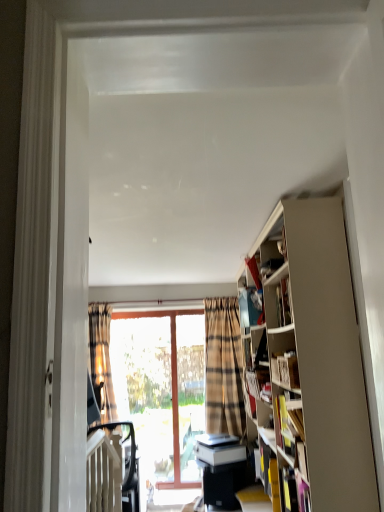
Question: Is plaid fabric curtain at left looking in the opposite direction of black glossy table at lower center?

Choices:
 (A) no
 (B) yes

Answer: (A)

Question: Is plaid fabric curtain at left located outside black glossy table at lower center?

Choices:
 (A) no
 (B) yes

Answer: (B)

Question: Is plaid fabric curtain at left in front of black glossy table at lower center?

Choices:
 (A) yes
 (B) no

Answer: (B)

Question: Does plaid fabric curtain at left have a greater width compared to black glossy table at lower center?

Choices:
 (A) no
 (B) yes

Answer: (A)

Question: Is plaid fabric curtain at left shorter than black glossy table at lower center?

Choices:
 (A) no
 (B) yes

Answer: (A)

Question: In terms of height, does black plastic swivel chair at lower left look taller or shorter compared to black glossy table at lower center?

Choices:
 (A) tall
 (B) short

Answer: (A)

Question: Considering the positions of black plastic swivel chair at lower left and black glossy table at lower center in the image, is black plastic swivel chair at lower left wider or thinner than black glossy table at lower center?

Choices:
 (A) wide
 (B) thin

Answer: (A)

Question: From the image's perspective, is black plastic swivel chair at lower left located above or below black glossy table at lower center?

Choices:
 (A) below
 (B) above

Answer: (B)

Question: Is black plastic swivel chair at lower left in front of or behind black glossy table at lower center in the image?

Choices:
 (A) behind
 (B) front

Answer: (B)

Question: In terms of size, does white matte bookshelf at right, placed as the first book when sorted from front to back, appear bigger or smaller than plaid fabric curtain at left?

Choices:
 (A) small
 (B) big

Answer: (A)

Question: From the image's perspective, is white matte bookshelf at right, which is counted as the 2th book, starting from the bottom, located above or below plaid fabric curtain at left?

Choices:
 (A) below
 (B) above

Answer: (B)

Question: Considering the positions of white matte bookshelf at right, the first book in the top-to-bottom sequence, and plaid fabric curtain at left in the image, is white matte bookshelf at right, the first book in the top-to-bottom sequence, wider or thinner than plaid fabric curtain at left?

Choices:
 (A) wide
 (B) thin

Answer: (B)

Question: From a real-world perspective, is white matte bookshelf at right, which is counted as the 2th book, starting from the bottom, physically located above or below plaid fabric curtain at left?

Choices:
 (A) above
 (B) below

Answer: (A)

Question: Based on their positions, is white matte bookshelf at right, placed as the first book when sorted from front to back, located to the left or right of black glossy table at lower center?

Choices:
 (A) right
 (B) left

Answer: (A)

Question: From their relative heights in the image, would you say white matte bookshelf at right, which is counted as the 2th book, starting from the bottom, is taller or shorter than black glossy table at lower center?

Choices:
 (A) short
 (B) tall

Answer: (A)